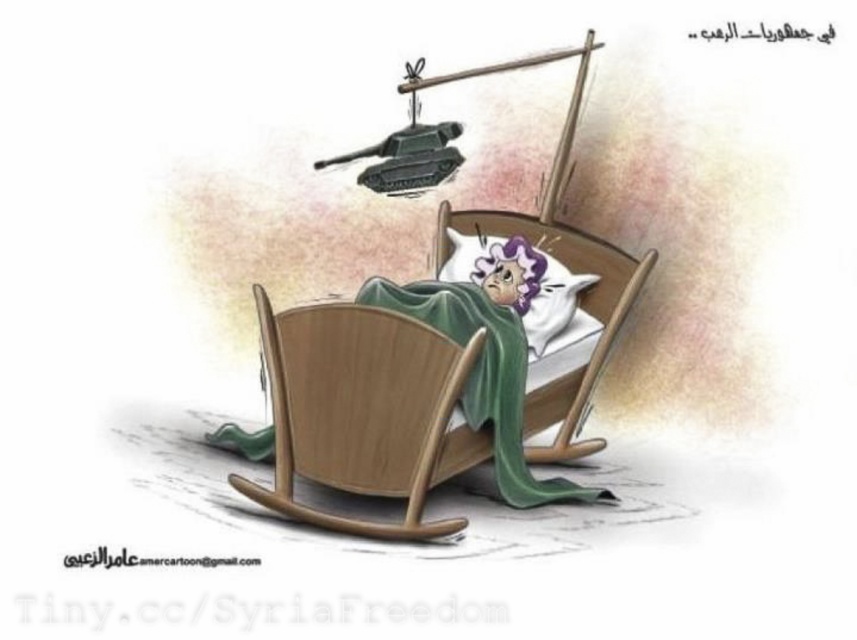
You are an architect designing a new hospital room. The wooden rocking chair at center is placed at coordinates 0.644, 0.425. If you want to ensure the chair is centrally located in the room, would its current position meet the requirement?

The wooden rocking chair at center is already positioned at the coordinates specified, which aligns with the requirement for central placement in the room.

In the political cartoon, there is an elderly woman in a wooden rocking chair bed. She is covered by the green soft blanket at center and the white soft pillow at center. Which object is placed higher on her bed?

The white soft pillow at center is placed higher on the bed than the green soft blanket at center because the green soft blanket at center is located below it.